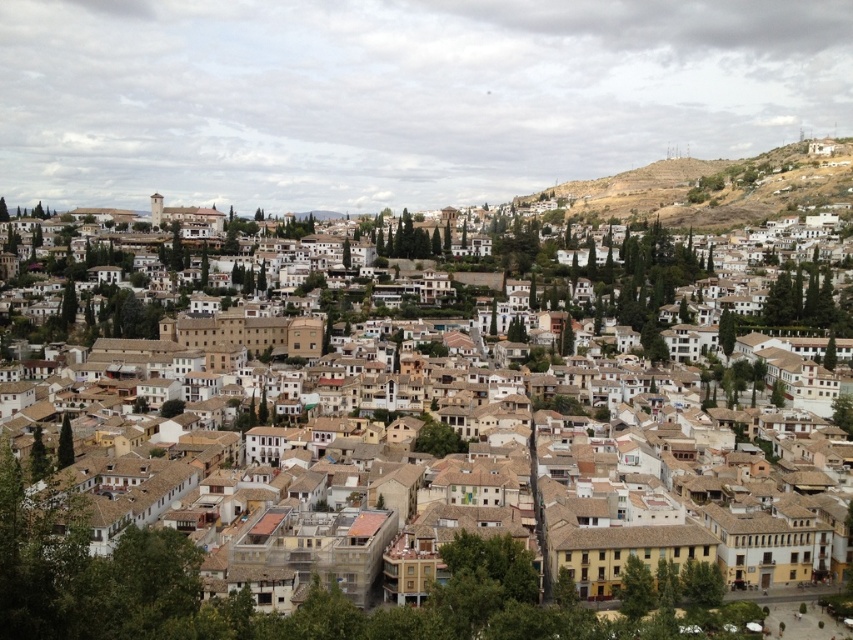
Between brown clay roof tiles at center and brown rocky hillside at upper right, which one is positioned lower?

Positioned lower is brown clay roof tiles at center.

Can you confirm if brown clay roof tiles at center is smaller than brown rocky hillside at upper right?

Indeed, brown clay roof tiles at center has a smaller size compared to brown rocky hillside at upper right.

Does point (384, 520) lie behind point (592, 205)?

No, (384, 520) is closer to viewer.

Where is `brown clay roof tiles at center`? The width and height of the screenshot is (853, 640). brown clay roof tiles at center is located at coordinates (231, 589).